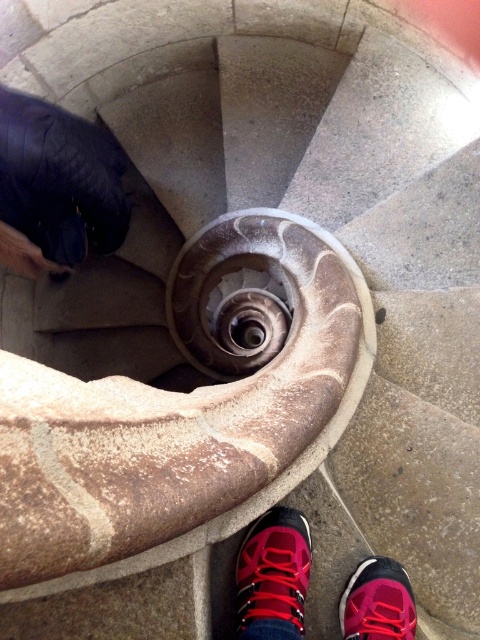
Question: Which object is positioned farthest from the red suede shoe at lower center?

Choices:
 (A) pink fabric shoe at lower center
 (B) red fabric shoe at lower center

Answer: (A)

Question: Considering the relative positions of red fabric shoe at lower center and pink fabric shoe at lower center in the image provided, where is red fabric shoe at lower center located with respect to pink fabric shoe at lower center?

Choices:
 (A) below
 (B) above

Answer: (B)

Question: Can you confirm if red fabric shoe at lower center is positioned below pink fabric shoe at lower center?

Choices:
 (A) no
 (B) yes

Answer: (A)

Question: In this image, where is red fabric shoe at lower center located relative to red suede shoe at lower center?

Choices:
 (A) right
 (B) left

Answer: (A)

Question: Which point is closer to the camera?

Choices:
 (A) red suede shoe at lower center
 (B) pink fabric shoe at lower center
 (C) red fabric shoe at lower center

Answer: (A)

Question: Considering the real-world distances, which object is farthest from the red fabric shoe at lower center?

Choices:
 (A) pink fabric shoe at lower center
 (B) red suede shoe at lower center

Answer: (A)